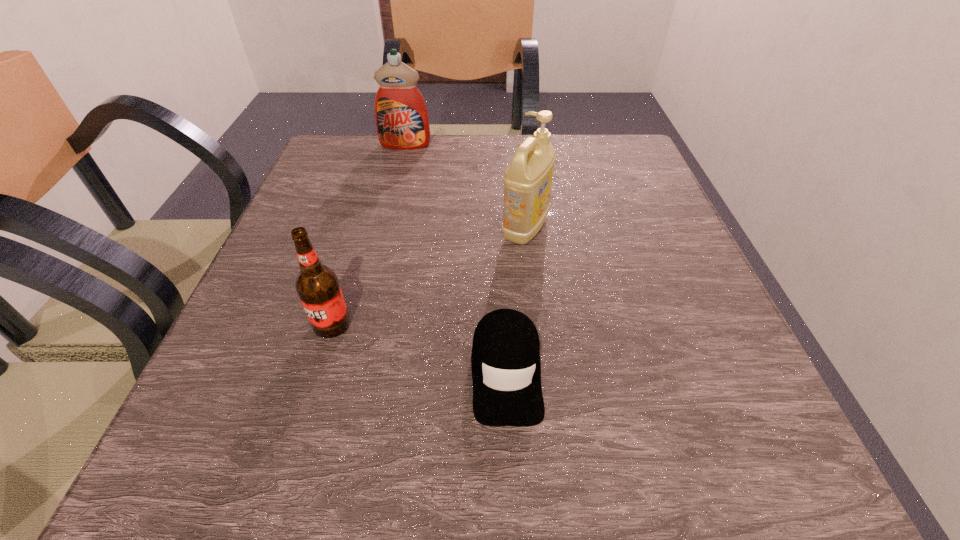
Where is `the left detergent`? The image size is (960, 540). the left detergent is located at coordinates (401, 116).

Where is `the farthest object`? This screenshot has width=960, height=540. the farthest object is located at coordinates (x=401, y=116).

You are a GUI agent. You are given a task and a screenshot of the screen. Output one action in this format:
    pyautogui.click(x=<x>, y=<y>)
    Task: Click on the right detergent
    
    Given the screenshot: What is the action you would take?
    pyautogui.click(x=527, y=180)

Identify the location of the second farthest object. The image size is (960, 540). (527, 180).

What are the coordinates of `root beer` in the screenshot? It's located at (317, 285).

The width and height of the screenshot is (960, 540). Identify the location of the shortest object. (506, 371).

This screenshot has width=960, height=540. In order to click on vacant area situated 0.310m on the front surface of the left detergent in this screenshot , I will do click(x=384, y=233).

Locate an element on the screen. Image resolution: width=960 pixels, height=540 pixels. vacant space located on the front of the nearer detergent is located at coordinates (551, 456).

Locate an element on the screen. This screenshot has height=540, width=960. vacant position located 0.120m on the front of the root beer is located at coordinates (305, 413).

Identify the location of object that is at the far edge. (401, 116).